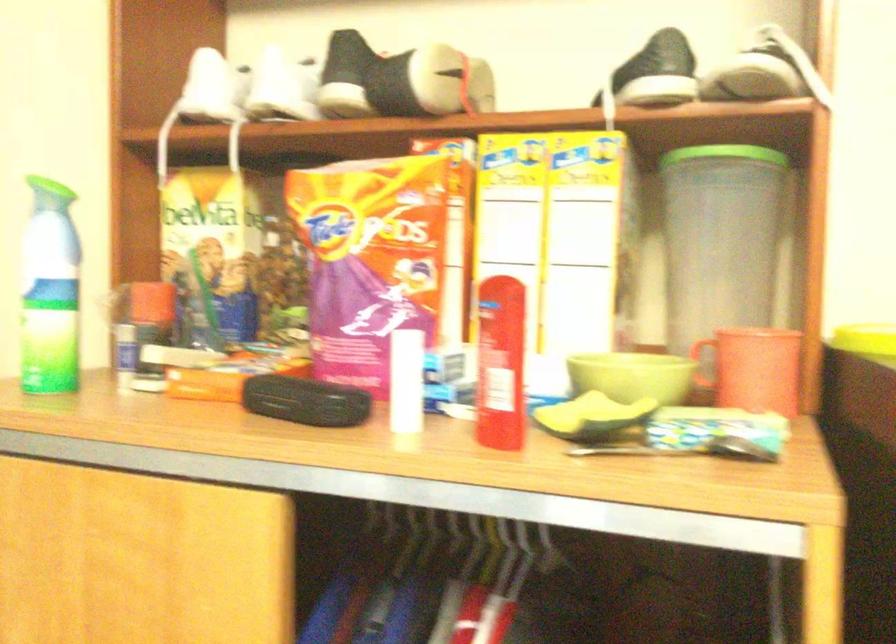
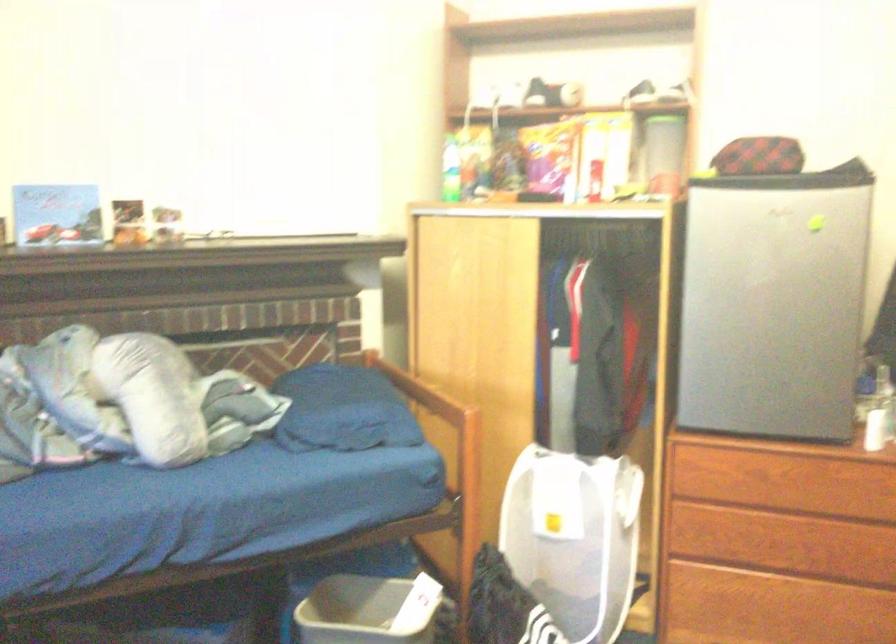
Question: The images are taken continuously from a first-person perspective. In which direction are you moving?

Choices:
 (A) Left
 (B) Right
 (C) Forward
 (D) Backward

Answer: (D)